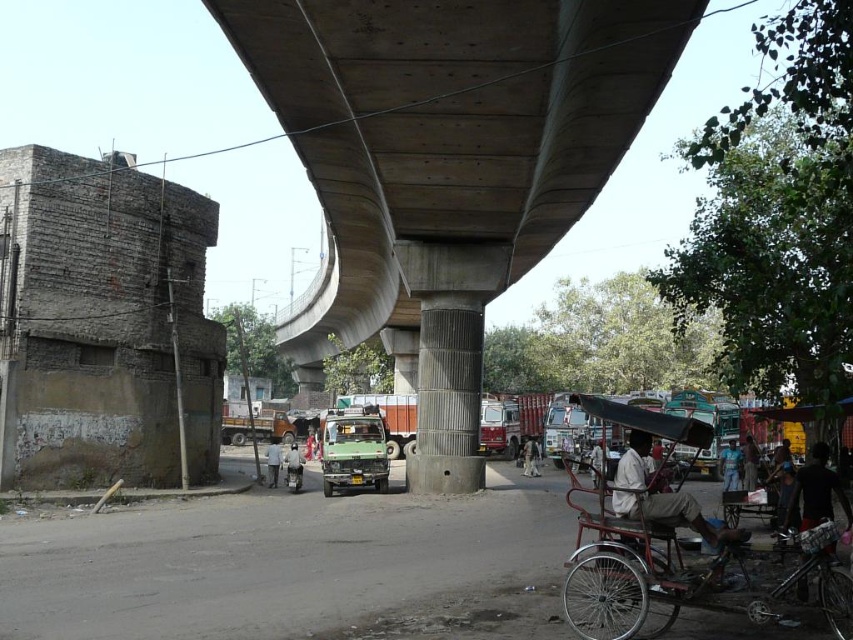
Does point (416, 394) lie behind point (276, 456)?

No, (416, 394) is closer to viewer.

In the scene shown: How distant is concrete textured column at center from light blue shirt at center?

concrete textured column at center and light blue shirt at center are 9.66 meters apart from each other.

Is point (445, 376) farther from camera compared to point (268, 451)?

No, (445, 376) is closer to viewer.

The width and height of the screenshot is (853, 640). I want to click on concrete textured column at center, so [x=448, y=396].

Who is more distant from viewer, (445, 476) or (599, 444)?

The point (599, 444) is more distant.

At what (x,y) coordinates should I click in order to perform the action: click on concrete textured column at center. Please return your answer as a coordinate pair (x, y). Looking at the image, I should click on (448, 396).

Where is `concrete textured column at center`? The image size is (853, 640). concrete textured column at center is located at coordinates (448, 396).

Can you confirm if dark blue fabric shirt at lower right is bigger than light gray fabric rickshaw at center?

Actually, dark blue fabric shirt at lower right might be smaller than light gray fabric rickshaw at center.

Measure the distance between dark blue fabric shirt at lower right and light gray fabric rickshaw at center.

dark blue fabric shirt at lower right is 22.30 meters away from light gray fabric rickshaw at center.

Locate an element on the screen. The height and width of the screenshot is (640, 853). dark blue fabric shirt at lower right is located at coordinates (815, 492).